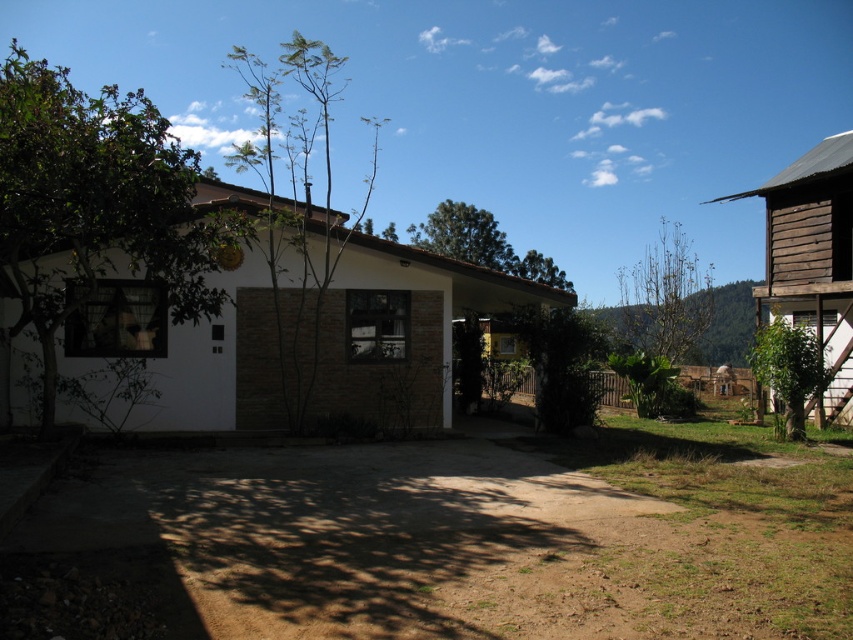
Question: Considering the real-world distances, which object is closest to the green leafy tree at center?

Choices:
 (A) white brick house at left
 (B) green leafy tree at left

Answer: (A)

Question: Among these objects, which one is nearest to the camera?

Choices:
 (A) green leafy tree at center
 (B) brown textured tree at center
 (C) green leafy tree at left

Answer: (C)

Question: Is green leafy tree at left wider than green leafy tree at right?

Choices:
 (A) yes
 (B) no

Answer: (A)

Question: Is wooden hut at right wider than brown textured tree at center?

Choices:
 (A) no
 (B) yes

Answer: (B)

Question: Which point appears farthest from the camera in this image?

Choices:
 (A) (799, 369)
 (B) (136, 198)
 (C) (404, 420)
 (D) (775, 240)

Answer: (D)

Question: Is green leafy tree at left bigger than green leafy tree at right?

Choices:
 (A) no
 (B) yes

Answer: (B)